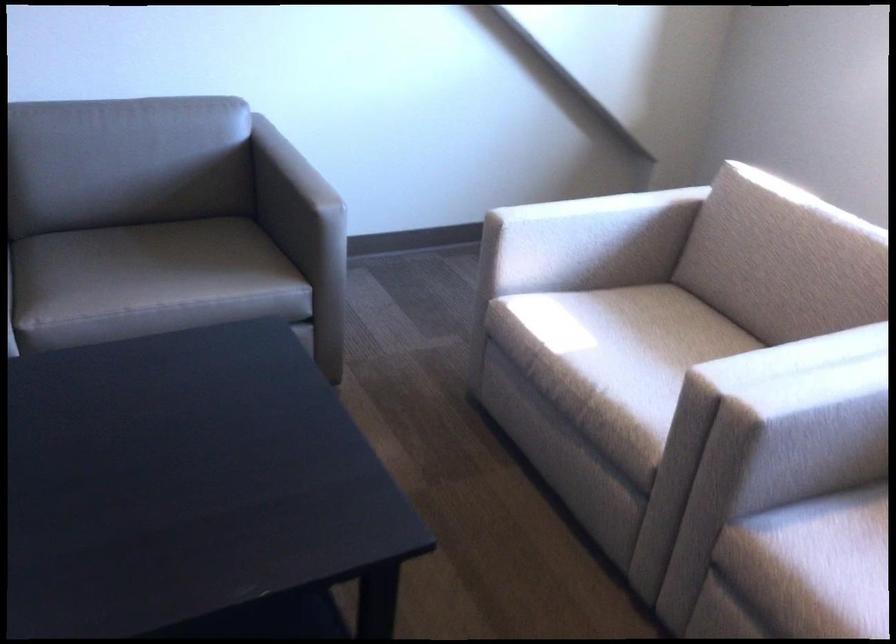
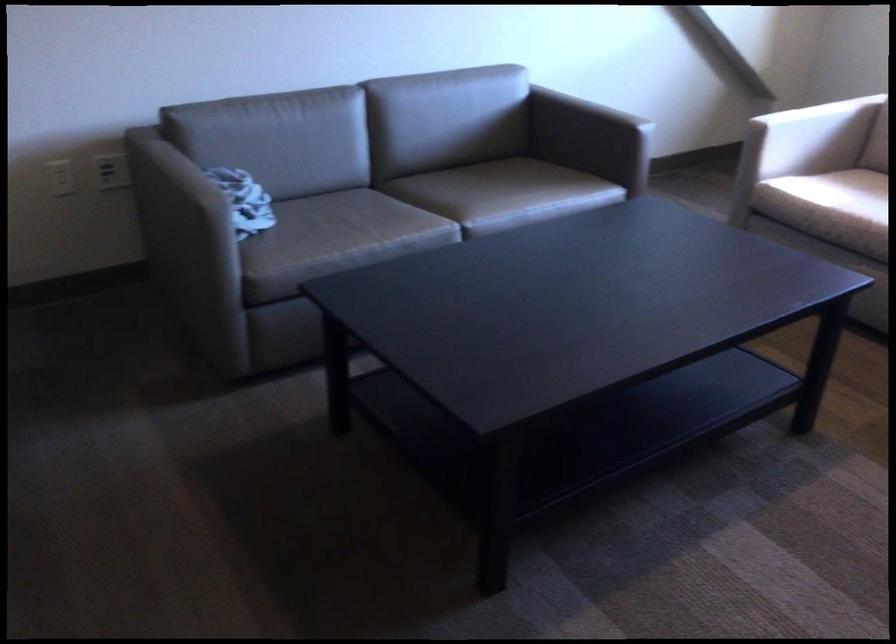
Find the pixel in the second image that matches (415,146) in the first image.

(605, 93)